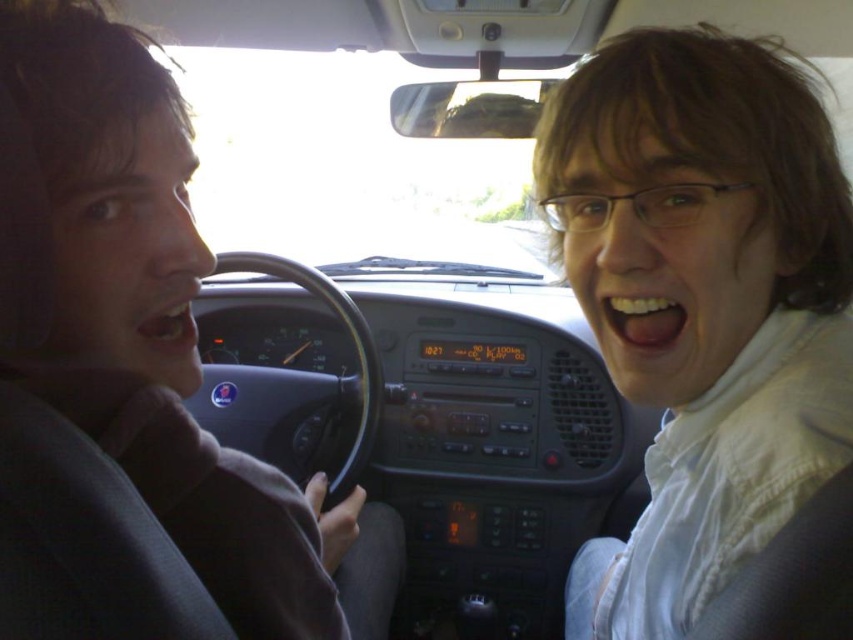
You are a passenger in the car and want to hand a document to the driver. The document is on the central console between the white matte jacket at center and the matte gray shirt at left. Which direction should you move the document to reach the driver?

The white matte jacket at center is taller than the matte gray shirt at left, so you should move the document towards the matte gray shirt at left to reach the driver.

You are a passenger in the car and want to place a rectangular box on the central console between the white matte jacket at center and the matte gray shirt at left. Can you fit it there?

The white matte jacket at center might be wider than matte gray shirt at left, so it is uncertain if the space between them is wide enough for the box. Check the actual width before placing it.

You are a delivery robot placed between the white matte jacket at center and the matte gray shirt at left in the car. You need to deliver a package to the passenger seat. Can you move freely between these two items to reach your destination?

The distance between the white matte jacket at center and the matte gray shirt at left is 16.39 inches, so the delivery robot can move freely between them to reach the passenger seat.